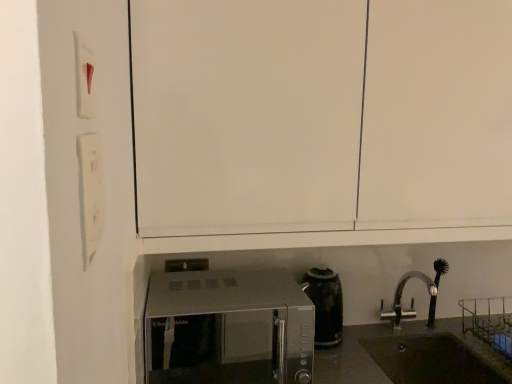
Question: Is white matte light switch at left, the 2th light switch in the top-to-bottom sequence, closer to camera compared to black glossy coffee pot at center?

Choices:
 (A) no
 (B) yes

Answer: (B)

Question: Considering the relative positions of white matte light switch at left, which is counted as the first light switch, starting from the bottom, and black glossy coffee pot at center in the image provided, is white matte light switch at left, which is counted as the first light switch, starting from the bottom, to the right of black glossy coffee pot at center from the viewer's perspective?

Choices:
 (A) no
 (B) yes

Answer: (A)

Question: Is white matte light switch at left, which is counted as the first light switch, starting from the bottom, bigger than black glossy coffee pot at center?

Choices:
 (A) no
 (B) yes

Answer: (A)

Question: Can black glossy coffee pot at center be found inside white matte light switch at left, which is counted as the first light switch, starting from the bottom?

Choices:
 (A) yes
 (B) no

Answer: (B)

Question: Does white matte light switch at left, which is counted as the first light switch, starting from the bottom, have a lesser width compared to black glossy coffee pot at center?

Choices:
 (A) yes
 (B) no

Answer: (A)

Question: Is white matte light switch at left, which is counted as the first light switch, starting from the bottom, in contact with black glossy coffee pot at center?

Choices:
 (A) no
 (B) yes

Answer: (A)

Question: From a real-world perspective, is black matte sink at lower right below white plastic light switch at upper left, the 1th light switch from the top?

Choices:
 (A) yes
 (B) no

Answer: (A)

Question: From the image's perspective, does black matte sink at lower right appear lower than white plastic light switch at upper left, the 1th light switch from the top?

Choices:
 (A) no
 (B) yes

Answer: (B)

Question: Is black matte sink at lower right beside white plastic light switch at upper left, the 1th light switch from the top?

Choices:
 (A) yes
 (B) no

Answer: (B)

Question: Does black matte sink at lower right have a larger size compared to white plastic light switch at upper left, the 1th light switch from the top?

Choices:
 (A) yes
 (B) no

Answer: (A)

Question: From a real-world perspective, does black matte sink at lower right stand above white plastic light switch at upper left, placed as the second light switch when sorted from bottom to top?

Choices:
 (A) yes
 (B) no

Answer: (B)

Question: Is black matte sink at lower right to the right of white plastic light switch at upper left, the 1th light switch from the top, from the viewer's perspective?

Choices:
 (A) no
 (B) yes

Answer: (B)

Question: From the image's perspective, would you say satin silver microwave at lower center is positioned over black matte sink at lower right?

Choices:
 (A) no
 (B) yes

Answer: (B)